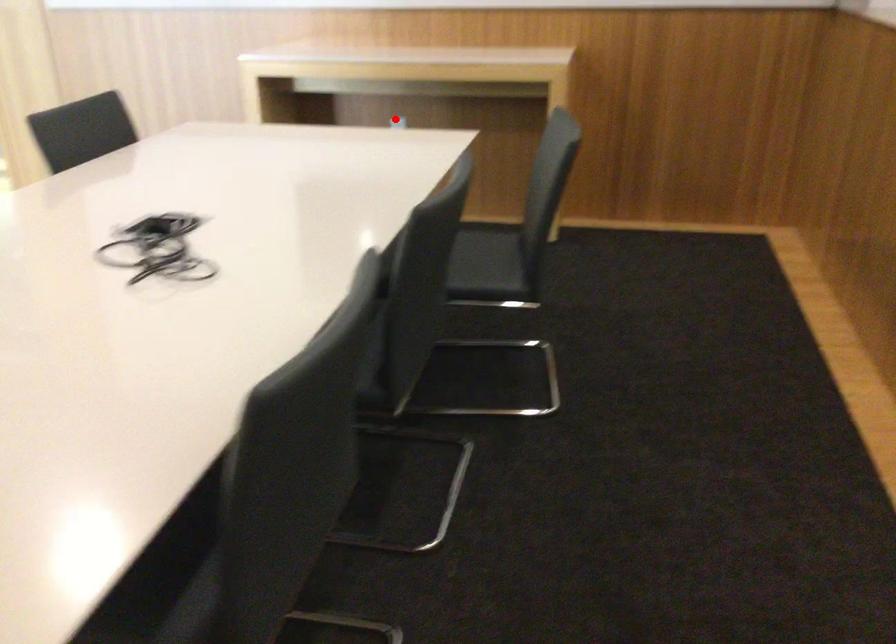
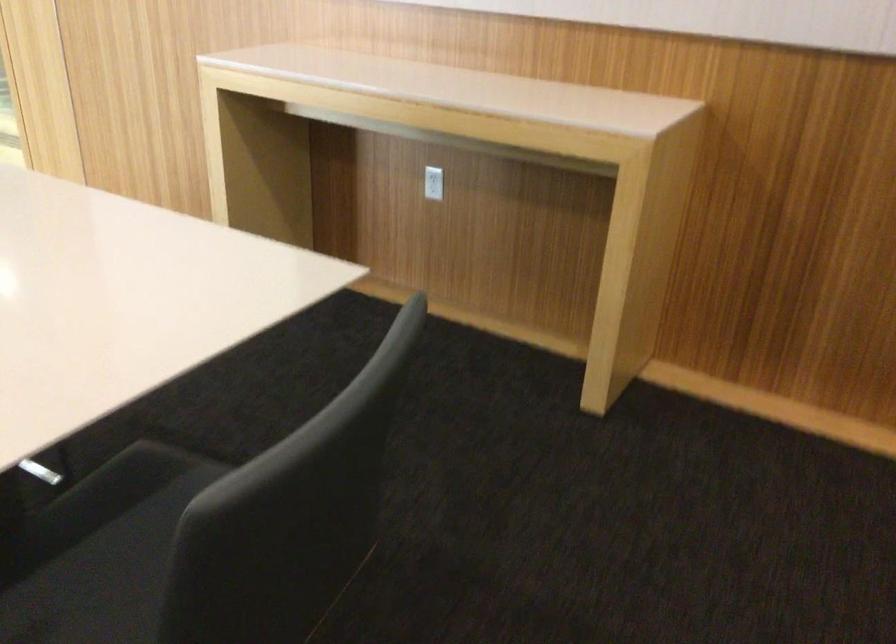
Question: I am providing you with two images of the same scene from different viewpoints. In image1, a red point is highlighted. Considering the same 3D point in image2, which of the following is correct?

Choices:
 (A) It is closer
 (B) It is farther

Answer: (A)